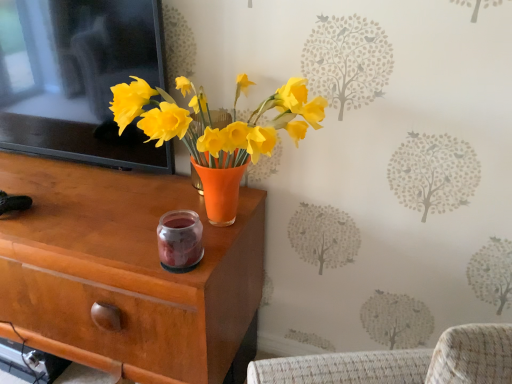
What is the approximate width of wooden desk at center?

It is 19.29 inches.

Describe the element at coordinates (125, 272) in the screenshot. I see `wooden desk at center` at that location.

Where is `wooden desk at center`? This screenshot has height=384, width=512. wooden desk at center is located at coordinates (125, 272).

Image resolution: width=512 pixels, height=384 pixels. Identify the location of wooden desk at center. (125, 272).